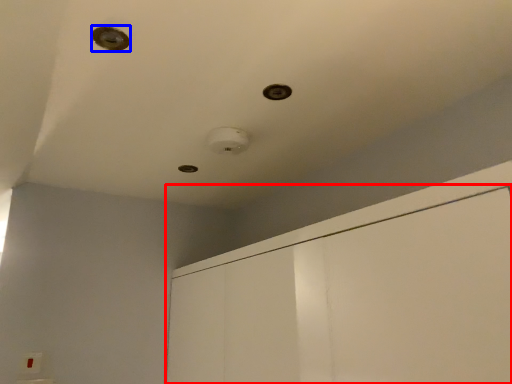
Question: Which object appears closest to the camera in this image, dresser (highlighted by a red box) or hole (highlighted by a blue box)?

Choices:
 (A) dresser
 (B) hole

Answer: (A)